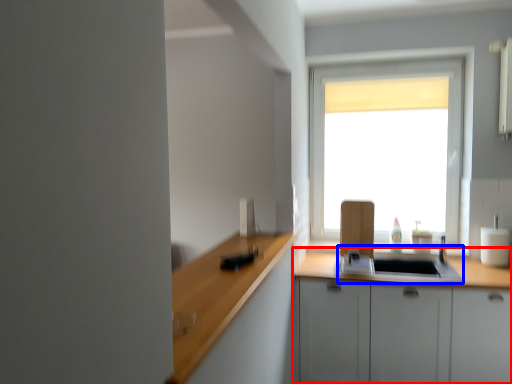
Question: Which object is further to the camera taking this photo, cabinetry (highlighted by a red box) or sink (highlighted by a blue box)?

Choices:
 (A) cabinetry
 (B) sink

Answer: (B)